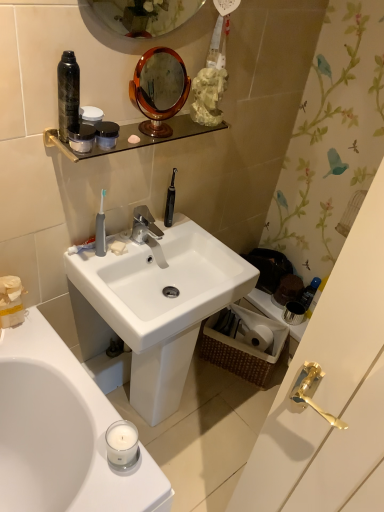
Question: From the image's perspective, is woven brown picnic basket at lower right above matte black jar at upper center, marked as the 2th mouthwash in a right-to-left arrangement?

Choices:
 (A) yes
 (B) no

Answer: (B)

Question: Can you confirm if woven brown picnic basket at lower right is thinner than matte black jar at upper center, placed as the 2th mouthwash when sorted from left to right?

Choices:
 (A) yes
 (B) no

Answer: (B)

Question: Is matte black jar at upper center, marked as the 2th mouthwash in a right-to-left arrangement, at the back of woven brown picnic basket at lower right?

Choices:
 (A) no
 (B) yes

Answer: (A)

Question: From a real-world perspective, is woven brown picnic basket at lower right physically below matte black jar at upper center, the 3th mouthwash when ordered from bottom to top?

Choices:
 (A) yes
 (B) no

Answer: (A)

Question: Is woven brown picnic basket at lower right wider than matte black jar at upper center, positioned as the second mouthwash in back-to-front order?

Choices:
 (A) yes
 (B) no

Answer: (A)

Question: From the image's perspective, does woven brown picnic basket at lower right appear lower than matte black jar at upper center, positioned as the second mouthwash in back-to-front order?

Choices:
 (A) no
 (B) yes

Answer: (B)

Question: Is white matte toilet paper at lower right beside silver metallic faucet at center?

Choices:
 (A) yes
 (B) no

Answer: (B)

Question: Is white matte toilet paper at lower right smaller than silver metallic faucet at center?

Choices:
 (A) yes
 (B) no

Answer: (B)

Question: Does white matte toilet paper at lower right appear on the right side of silver metallic faucet at center?

Choices:
 (A) yes
 (B) no

Answer: (A)

Question: Is white matte toilet paper at lower right closer to camera compared to silver metallic faucet at center?

Choices:
 (A) no
 (B) yes

Answer: (A)

Question: From a real-world perspective, is white matte toilet paper at lower right beneath silver metallic faucet at center?

Choices:
 (A) yes
 (B) no

Answer: (A)

Question: Is white matte toilet paper at lower right looking in the opposite direction of silver metallic faucet at center?

Choices:
 (A) no
 (B) yes

Answer: (A)

Question: Is blue glossy bottle at right, arranged as the third mouthwash when viewed from the left, completely or partially outside of woven brown picnic basket at lower right?

Choices:
 (A) no
 (B) yes

Answer: (B)